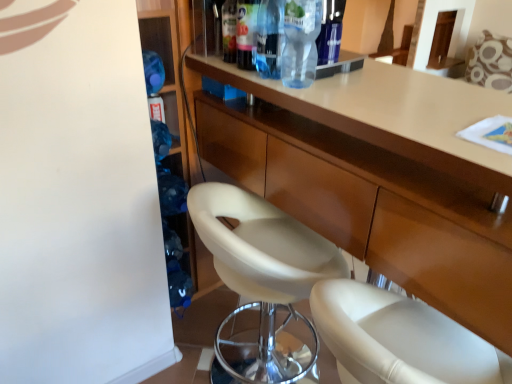
The image size is (512, 384). I want to click on empty space that is to the right of transparent plastic bottle at upper center, which ranks as the 2th bottle in left-to-right order, so (345, 82).